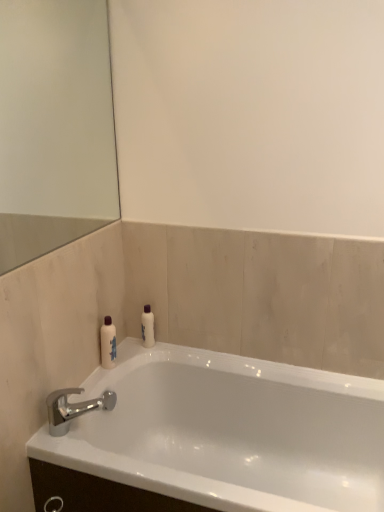
Where is `free space in front of white glossy bottle at left, the first toiletry in the left-to-right sequence`? The image size is (384, 512). free space in front of white glossy bottle at left, the first toiletry in the left-to-right sequence is located at coordinates (94, 385).